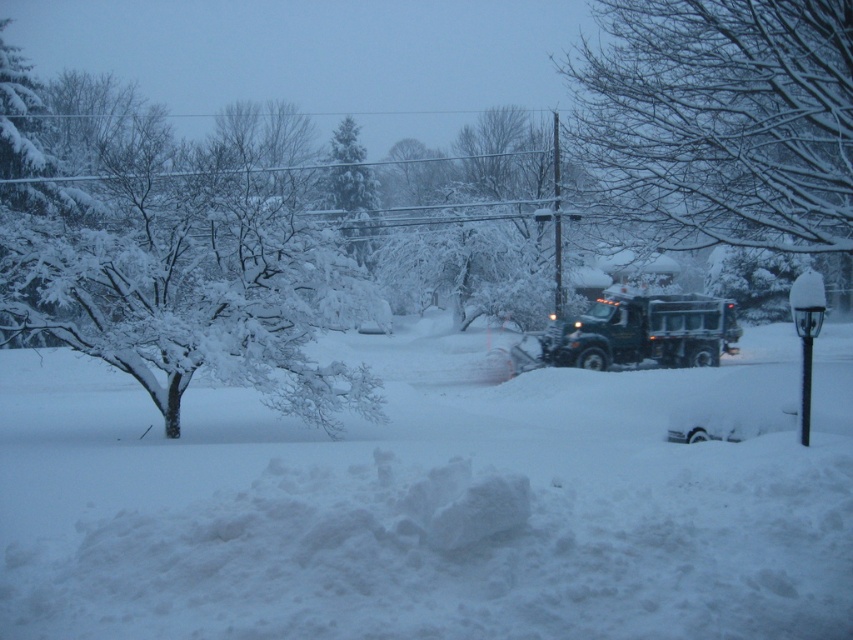
Does white snow-covered tree at left have a lesser height compared to snow-covered evergreen at center?

No.

Who is more distant from viewer, (88, 253) or (347, 216)?

The point (347, 216) is behind.

Locate an element on the screen. white snow-covered tree at left is located at coordinates (183, 257).

Which is behind, point (668, 112) or point (625, 304)?

Positioned behind is point (625, 304).

Between snow-covered branches at upper center and green matte truck at center, which one is positioned higher?

Positioned higher is snow-covered branches at upper center.

Find the location of a particular element. snow-covered branches at upper center is located at coordinates (721, 120).

Can you confirm if white snow-covered tree at left is wider than snow-covered branches at upper center?

Correct, the width of white snow-covered tree at left exceeds that of snow-covered branches at upper center.

Can you confirm if white snow-covered tree at left is positioned below snow-covered branches at upper center?

Correct, white snow-covered tree at left is located below snow-covered branches at upper center.

The image size is (853, 640). Identify the location of white snow-covered tree at left. (183, 257).